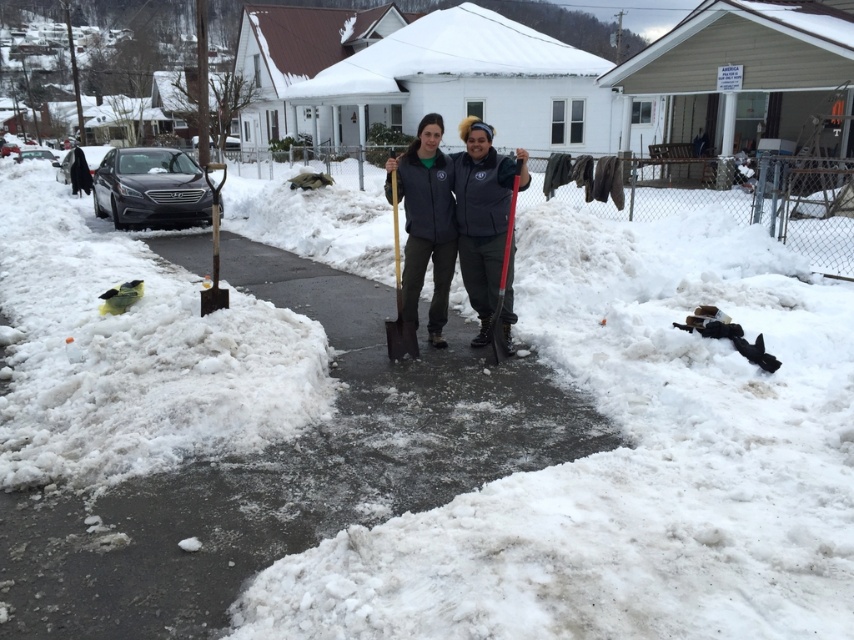
You are standing on the snowy street and see both the wooden shovel at center and the red plastic shovel at center. Which shovel is positioned to the left of the other?

The wooden shovel at center is positioned to the left of the red plastic shovel at center.

You are a delivery person trying to deliver a package to the house with the red roof. You see the matte gray jacket at center and the red plastic shovel at center. Which object is larger?

The matte gray jacket at center is bigger than the red plastic shovel at center.

You are standing at the origin of the coordinate system in the snowy street scene. You see two points marked in the image. Which point is closer to you, point [405,172] or point [499,353]?

Point [405,172] is in front of point [499,353], so it is closer to you.